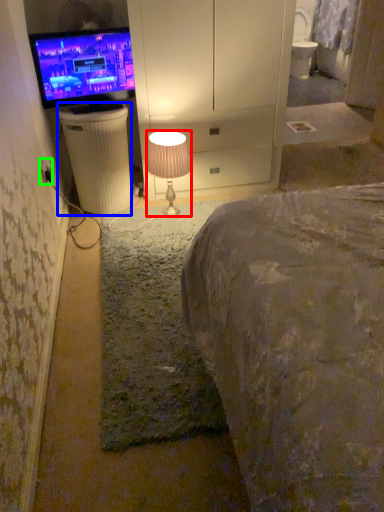
Question: Which is nearer to the lamp (highlighted by a red box)? trash bin/can (highlighted by a blue box) or electric outlet (highlighted by a green box).

Choices:
 (A) trash bin/can
 (B) electric outlet

Answer: (A)